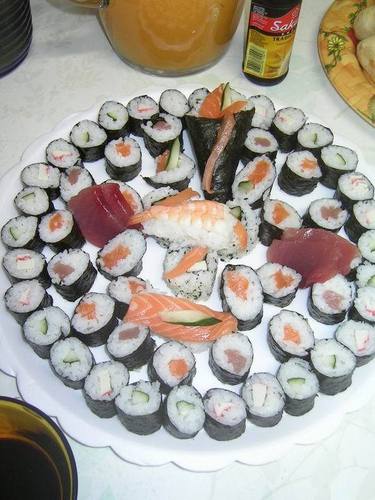
Locate an element on the screen. table is located at coordinates (83, 80).